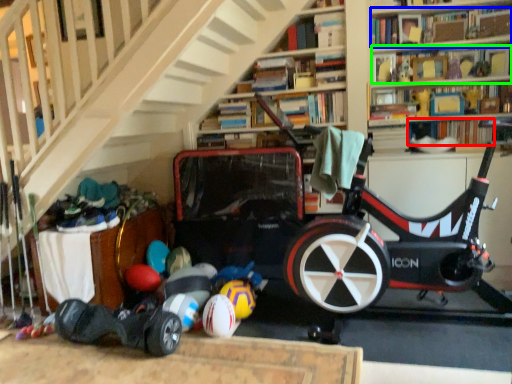
Question: Estimate the real-world distances between objects in this image. Which object is closer to book (highlighted by a red box), book (highlighted by a blue box) or book (highlighted by a green box)?

Choices:
 (A) book
 (B) book

Answer: (B)